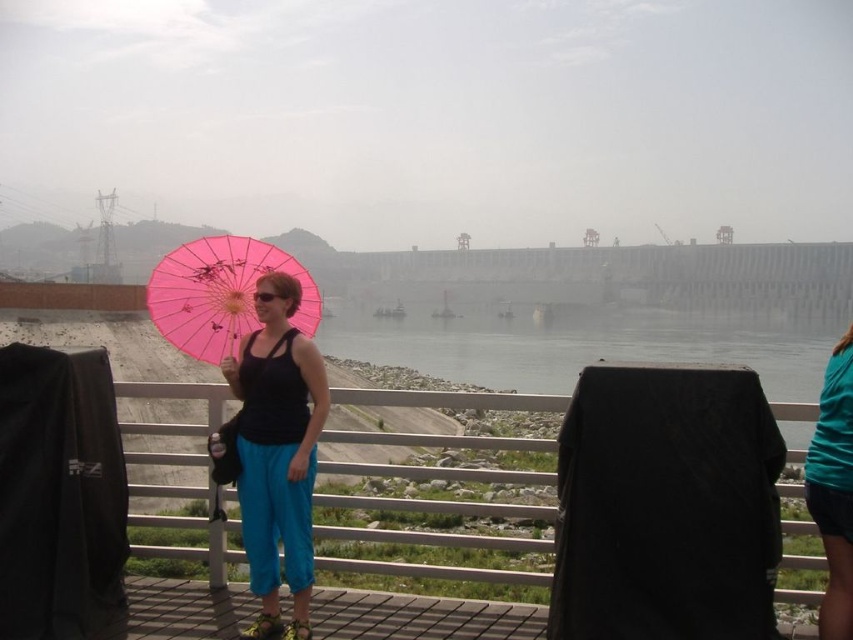
Question: Is pink paper umbrella at center above teal fabric shirt at right?

Choices:
 (A) no
 (B) yes

Answer: (B)

Question: Among these objects, which one is nearest to the camera?

Choices:
 (A) matte pink umbrella at left
 (B) pink paper umbrella at center

Answer: (A)

Question: Among these points, which one is nearest to the camera?

Choices:
 (A) (x=198, y=280)
 (B) (x=279, y=444)
 (C) (x=819, y=413)

Answer: (C)

Question: Where is pink paper umbrella at center located in relation to teal fabric shirt at right in the image?

Choices:
 (A) left
 (B) right

Answer: (A)

Question: Can you confirm if pink paper umbrella at center is positioned below teal fabric shirt at right?

Choices:
 (A) no
 (B) yes

Answer: (A)

Question: Among these points, which one is farthest from the camera?

Choices:
 (A) (155, 280)
 (B) (286, 504)

Answer: (A)